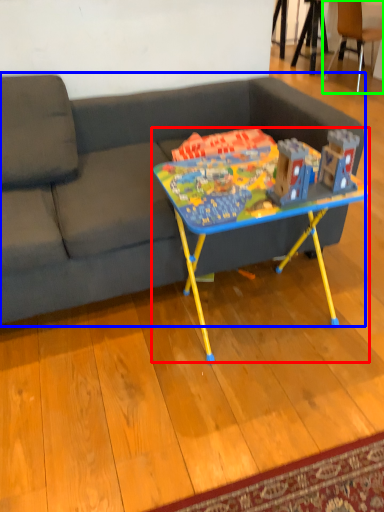
Question: Which object is the closest to the table (highlighted by a red box)? Choose among these: studio couch (highlighted by a blue box) or chair (highlighted by a green box).

Choices:
 (A) studio couch
 (B) chair

Answer: (A)